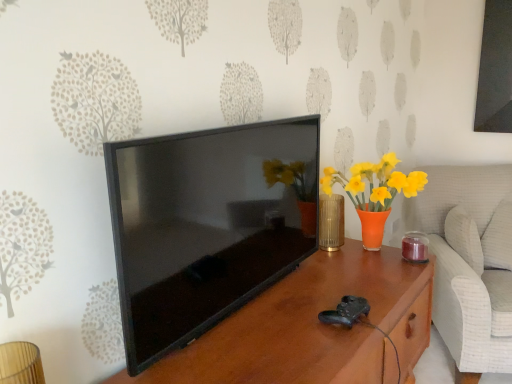
Image resolution: width=512 pixels, height=384 pixels. What are the coordinates of `vacant area that lies in front of black glossy tv at center` in the screenshot? It's located at (260, 340).